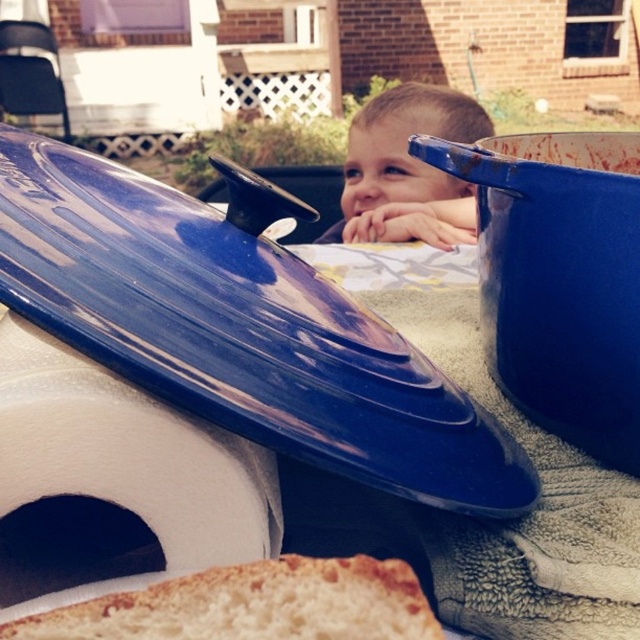
Question: Which object appears closest to the camera in this image?

Choices:
 (A) white foam toilet paper at lower left
 (B) smooth skin toddler at center
 (C) glossy blue lid at center

Answer: (C)

Question: Can you confirm if glossy blue lid at center is positioned to the left of white foam toilet paper at lower left?

Choices:
 (A) yes
 (B) no

Answer: (B)

Question: Does white foam toilet paper at lower left have a greater width compared to smooth skin toddler at center?

Choices:
 (A) yes
 (B) no

Answer: (B)

Question: Among these points, which one is farthest from the camera?

Choices:
 (A) (358, 179)
 (B) (241, 278)

Answer: (A)

Question: Estimate the real-world distances between objects in this image. Which object is closer to the white foam toilet paper at lower left?

Choices:
 (A) glossy blue lid at center
 (B) golden brown crusty bread at lower center

Answer: (A)

Question: Is white foam toilet paper at lower left positioned before golden brown crusty bread at lower center?

Choices:
 (A) no
 (B) yes

Answer: (A)